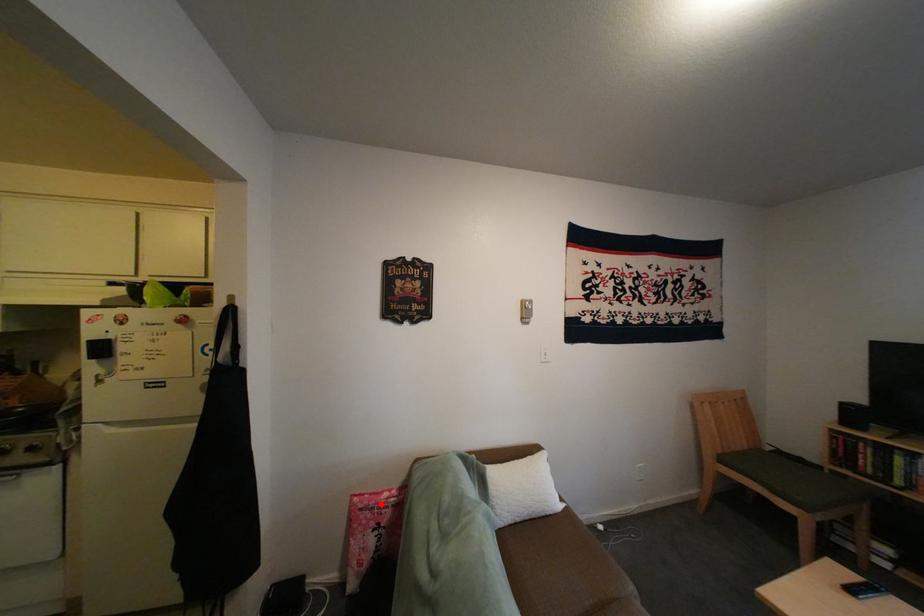
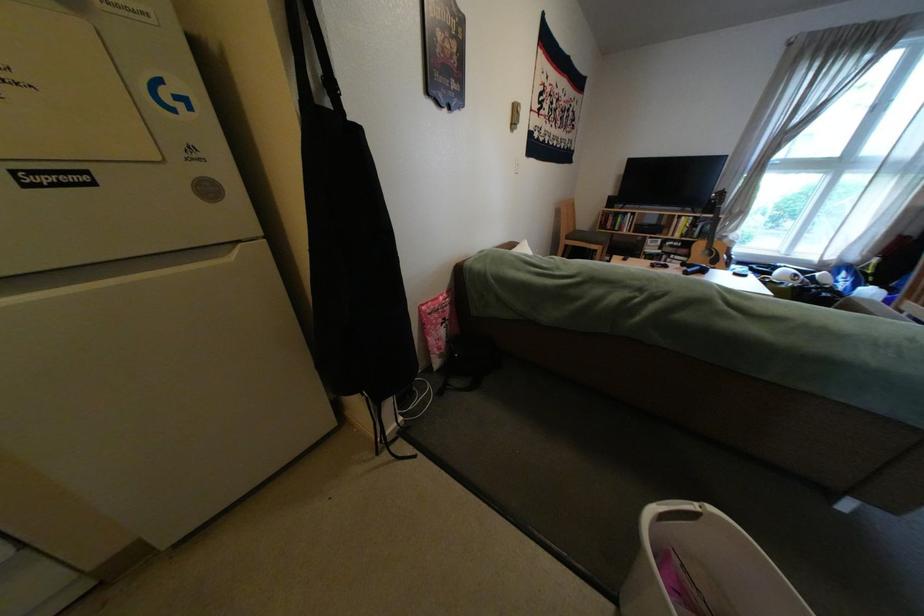
Question: I am providing you with two images of the same scene from different viewpoints. A red point is marked on the first image. Can you still see the location of the red point in image 2?

Choices:
 (A) Yes
 (B) No

Answer: (A)